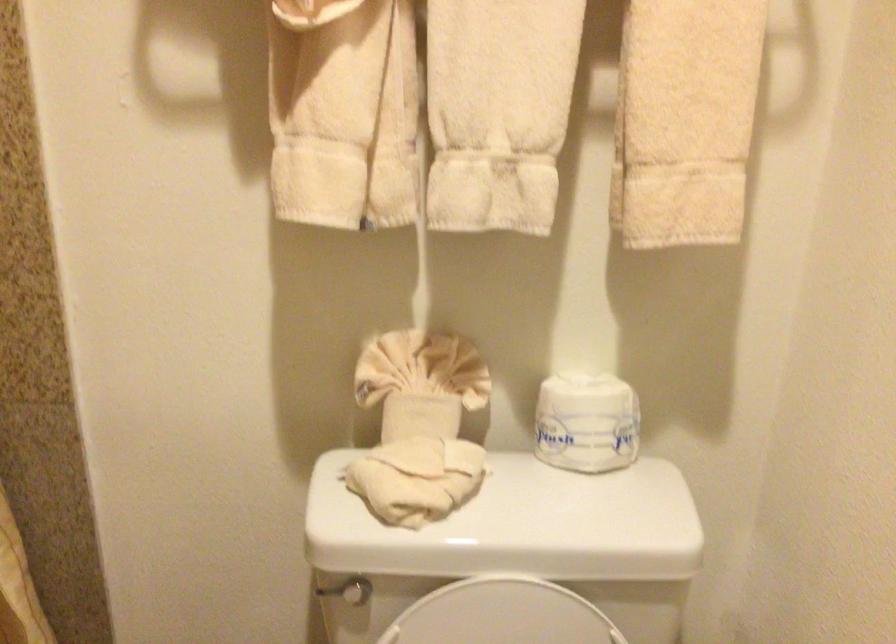
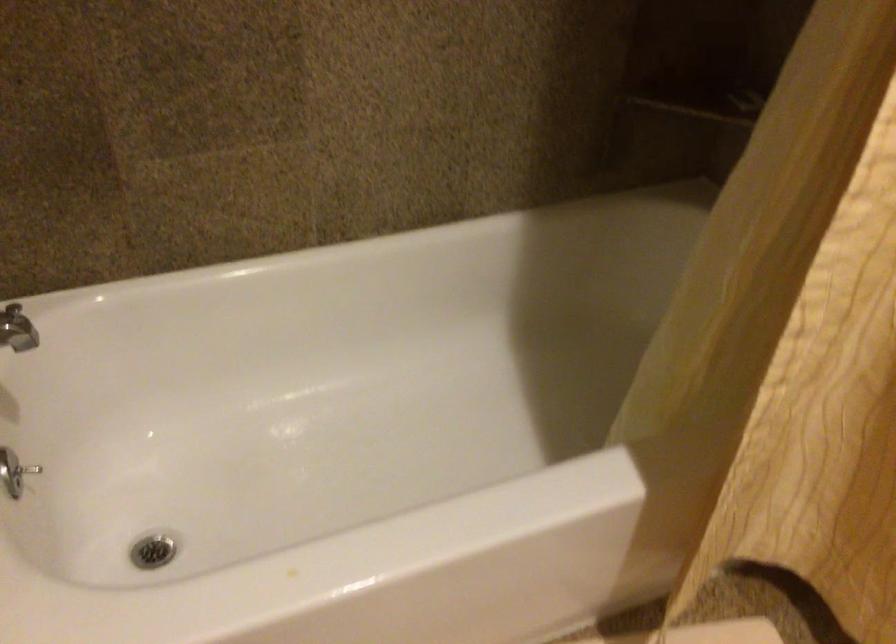
The first image is from the beginning of the video and the second image is from the end. How did the camera likely rotate when shooting the video?

The camera's rotation is toward left-down.